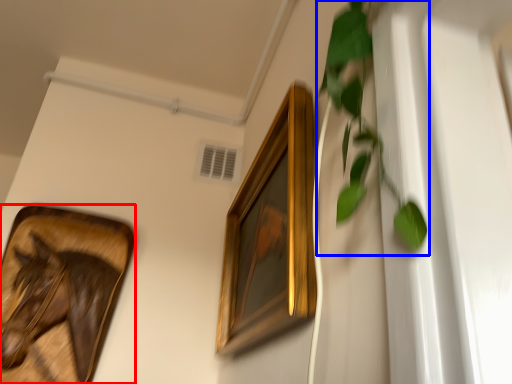
Question: Which object appears farthest to the camera in this image, picture frame (highlighted by a red box) or vegetation (highlighted by a blue box)?

Choices:
 (A) picture frame
 (B) vegetation

Answer: (A)